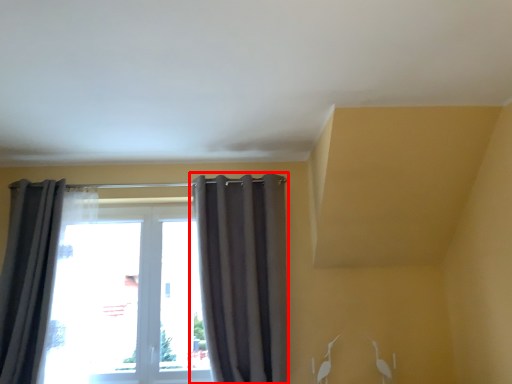
Question: From the image, what is the correct spatial relationship of curtain (annotated by the red box) in relation to curtain?

Choices:
 (A) right
 (B) left

Answer: (A)